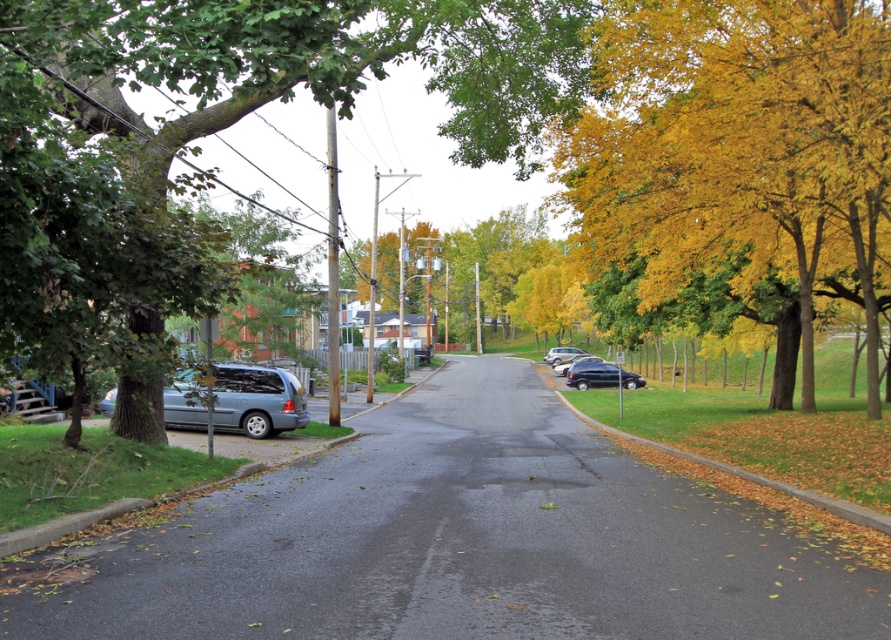
Question: Does yellow/golden leaves at right appear over satin silver sedan at center?

Choices:
 (A) no
 (B) yes

Answer: (B)

Question: Can you confirm if yellow leafy tree at center is positioned to the left of glossy black suv at center-right?

Choices:
 (A) yes
 (B) no

Answer: (A)

Question: Considering the relative positions of matte gray minivan at left and satin silver sedan at center in the image provided, where is matte gray minivan at left located with respect to satin silver sedan at center?

Choices:
 (A) above
 (B) below

Answer: (B)

Question: Based on their relative distances, which object is nearer to the glossy black suv at center-right?

Choices:
 (A) matte gray minivan at left
 (B) satin silver sedan at center
 (C) yellow/golden leaves at right
 (D) green leafy tree at left

Answer: (C)

Question: Estimate the real-world distances between objects in this image. Which object is farther from the satin silver sedan at center?

Choices:
 (A) yellow leafy tree at center
 (B) yellow/golden leaves at right
 (C) glossy black suv at center-right
 (D) green leafy tree at left

Answer: (B)

Question: Which object is closer to the camera taking this photo?

Choices:
 (A) glossy black suv at center-right
 (B) yellow/golden leaves at right
 (C) yellow leafy tree at center
 (D) satin silver sedan at center

Answer: (B)